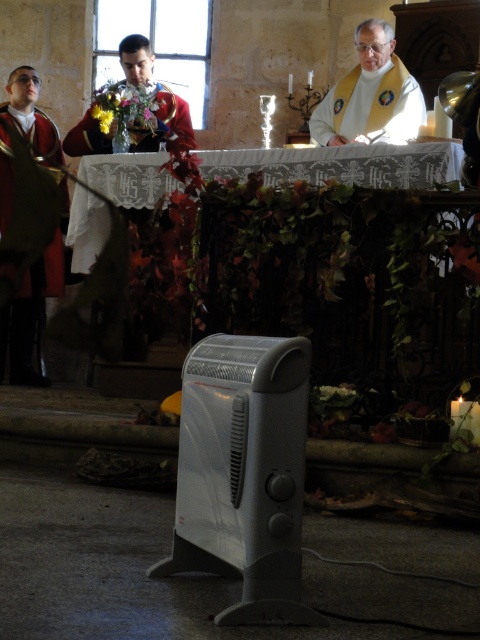
Between white glossy vest at upper center and matte red uniform at center, which one appears on the right side from the viewer's perspective?

white glossy vest at upper center is more to the right.

Image resolution: width=480 pixels, height=640 pixels. What do you see at coordinates (371, 93) in the screenshot? I see `white glossy vest at upper center` at bounding box center [371, 93].

Identify the location of white glossy vest at upper center. Image resolution: width=480 pixels, height=640 pixels. (371, 93).

Who is taller, matte green robe at left or matte red uniform at center?

matte green robe at left is taller.

Which of these two, matte green robe at left or matte red uniform at center, stands shorter?

matte red uniform at center is shorter.

Between point (27, 291) and point (189, 134), which one is positioned behind?

Positioned behind is point (189, 134).

The height and width of the screenshot is (640, 480). Find the location of `matte green robe at left`. matte green robe at left is located at coordinates (24, 132).

Measure the distance between white glossy vest at upper center and camera.

white glossy vest at upper center is 5.31 meters from camera.

Is white glossy vest at upper center bigger than matte green robe at left?

Indeed, white glossy vest at upper center has a larger size compared to matte green robe at left.

Where is `white glossy vest at upper center`? Image resolution: width=480 pixels, height=640 pixels. white glossy vest at upper center is located at coordinates (371, 93).